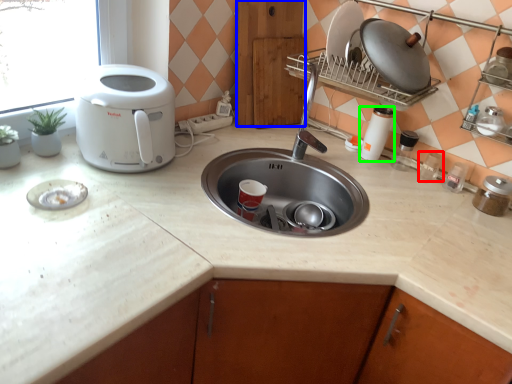
Question: Considering the real-world distances, which object is farthest from appliance (highlighted by a red box)? cabinetry (highlighted by a blue box) or appliance (highlighted by a green box)?

Choices:
 (A) cabinetry
 (B) appliance

Answer: (A)